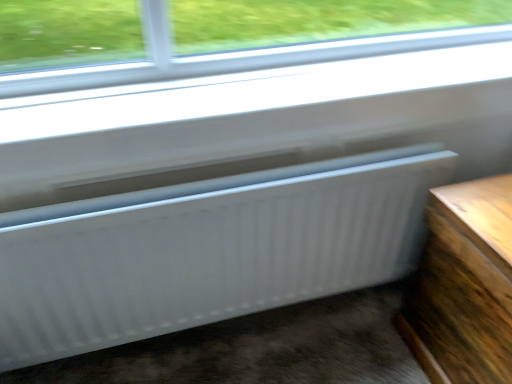
Question: Could you tell me if white ribbed radiator at lower center is turned towards wooden table at lower right?

Choices:
 (A) yes
 (B) no

Answer: (A)

Question: Can you confirm if white ribbed radiator at lower center is thinner than wooden table at lower right?

Choices:
 (A) yes
 (B) no

Answer: (A)

Question: Considering the relative positions of white ribbed radiator at lower center and wooden table at lower right in the image provided, is white ribbed radiator at lower center behind wooden table at lower right?

Choices:
 (A) no
 (B) yes

Answer: (B)

Question: Is white ribbed radiator at lower center beside wooden table at lower right?

Choices:
 (A) yes
 (B) no

Answer: (B)

Question: Does white ribbed radiator at lower center lie in front of wooden table at lower right?

Choices:
 (A) yes
 (B) no

Answer: (B)

Question: Does white ribbed radiator at lower center have a greater width compared to wooden table at lower right?

Choices:
 (A) no
 (B) yes

Answer: (A)

Question: Is wooden table at lower right oriented towards white ribbed radiator at lower center?

Choices:
 (A) yes
 (B) no

Answer: (A)

Question: Is wooden table at lower right shorter than white ribbed radiator at lower center?

Choices:
 (A) no
 (B) yes

Answer: (A)

Question: Is white ribbed radiator at lower center inside wooden table at lower right?

Choices:
 (A) no
 (B) yes

Answer: (A)

Question: From the image's perspective, is wooden table at lower right over white ribbed radiator at lower center?

Choices:
 (A) no
 (B) yes

Answer: (A)

Question: From a real-world perspective, is wooden table at lower right on top of white ribbed radiator at lower center?

Choices:
 (A) no
 (B) yes

Answer: (A)

Question: Is wooden table at lower right facing away from white ribbed radiator at lower center?

Choices:
 (A) no
 (B) yes

Answer: (A)

Question: Is wooden table at lower right inside the boundaries of white ribbed radiator at lower center, or outside?

Choices:
 (A) outside
 (B) inside

Answer: (A)